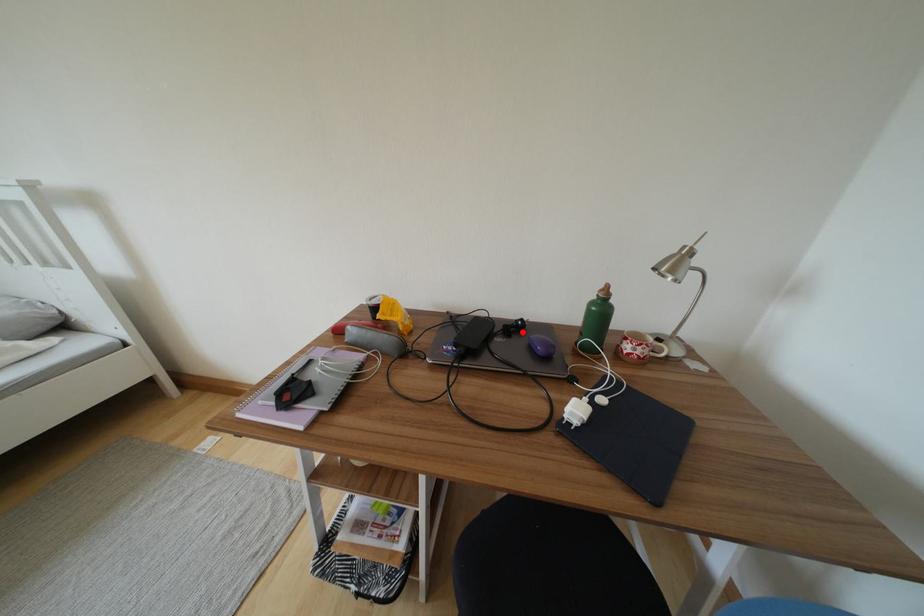
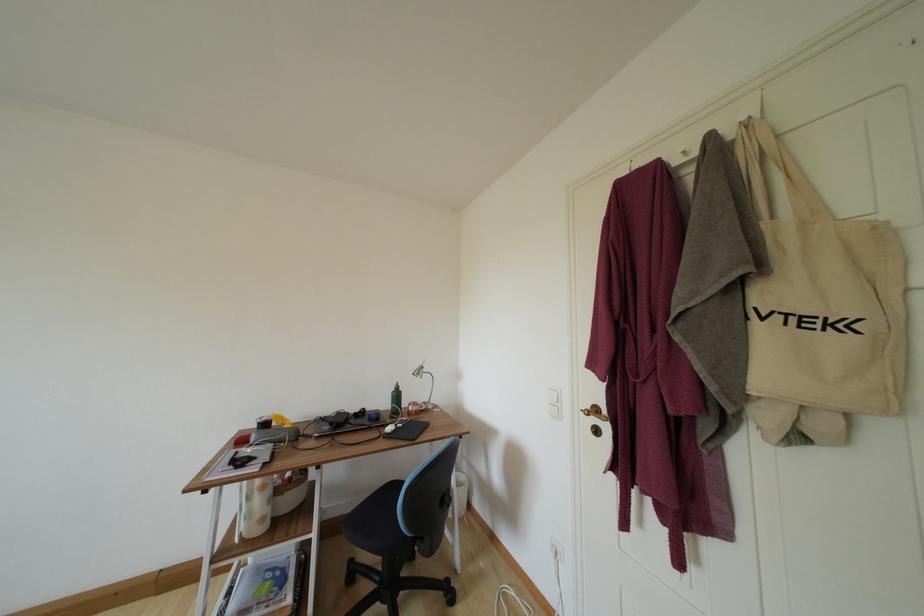
The point at the highlighted location is marked in the first image. Where is the corresponding point in the second image?

(367, 416)